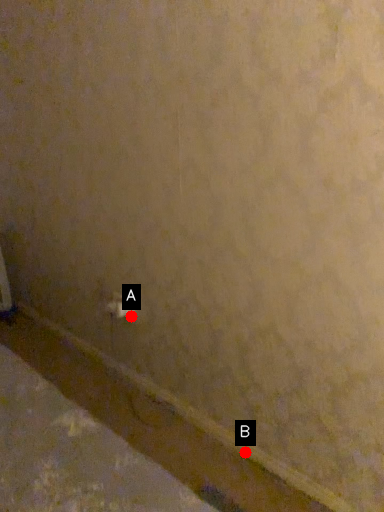
Question: Two points are circled on the image, labeled by A and B beside each circle. Among these points, which one is nearest to the camera?

Choices:
 (A) A is closer
 (B) B is closer

Answer: (B)